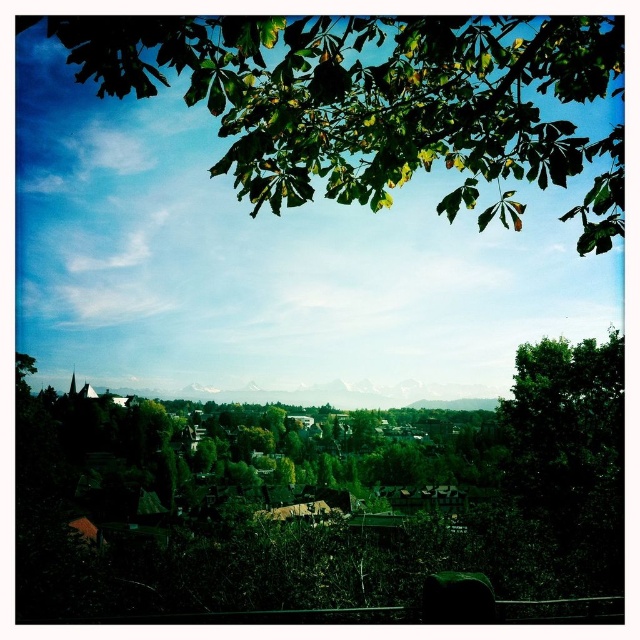
Looking at this image, you are standing at the viewpoint looking at the green leafy tree at upper center and the green grassy hillside at center. Which object is located to the right of the other?

The green grassy hillside at center is located to the right of the green leafy tree at upper center because the tree is positioned on the left side of the hillside.

You are standing at the viewpoint looking at the town. Which object is higher up in the image between the green leafy tree at upper center and the green grassy hillside at center?

The green leafy tree at upper center is higher up in the image than the green grassy hillside at center.

You are standing at the highest point of the hillside viewpoint looking at the town below. You notice a specific coordinate marked as point [374,99]. What object does this coordinate point to in the scene?

The coordinate point [374,99] corresponds to the green leafy tree at upper center in the scene.